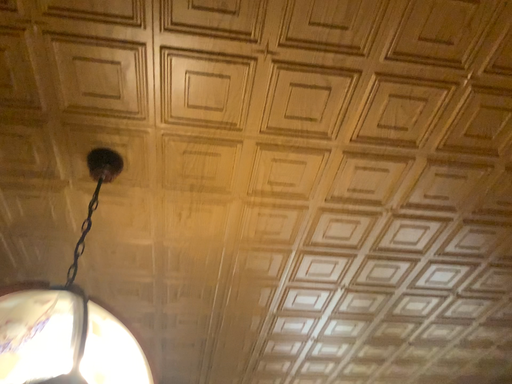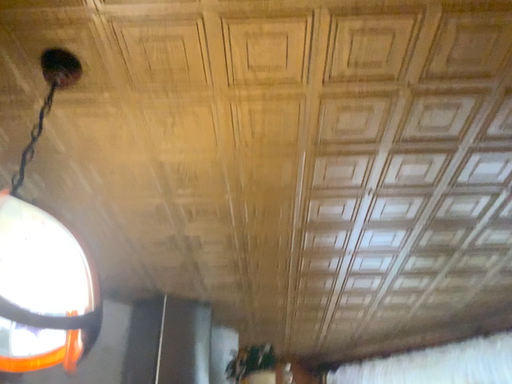
Question: Which way did the camera rotate in the video?

Choices:
 (A) rotated right
 (B) rotated left

Answer: (B)